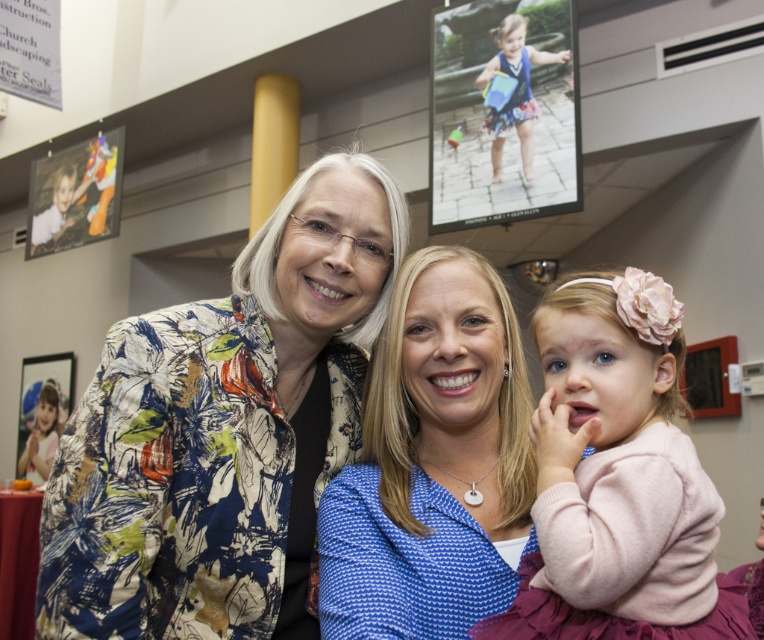
Question: In this image, where is floral-patterned jacket at center located relative to blue fabric dress at upper center?

Choices:
 (A) below
 (B) above

Answer: (A)

Question: Considering the real-world distances, which object is closest to the blue fabric dress at upper center?

Choices:
 (A) floral-patterned jacket at upper left
 (B) floral-patterned jacket at center

Answer: (A)

Question: Which point appears closest to the camera in this image?

Choices:
 (A) (523, 172)
 (B) (494, 352)
 (C) (47, 417)
 (D) (65, 480)

Answer: (D)

Question: Does floral-patterned jacket at center have a lesser width compared to pink fabric dress at lower right?

Choices:
 (A) yes
 (B) no

Answer: (B)

Question: Does floral-patterned jacket at upper left appear over pink fabric dress at lower right?

Choices:
 (A) yes
 (B) no

Answer: (A)

Question: Which of the following is the closest to the observer?

Choices:
 (A) (63, 547)
 (B) (591, 328)

Answer: (B)